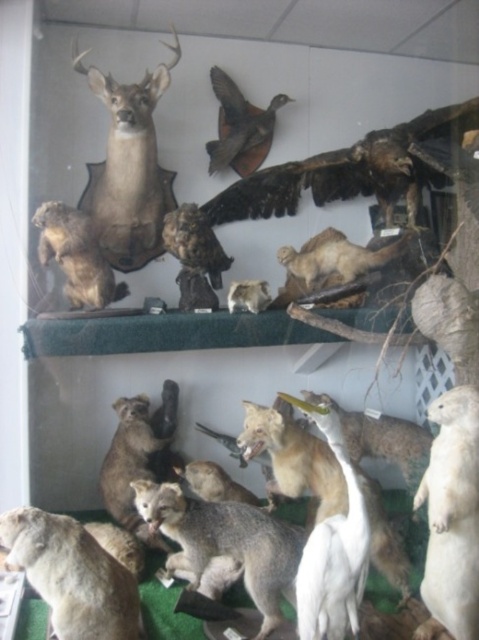
You are a museum visitor standing in front of the display. You notice the matte brown deer at upper left and the brown matte bird at upper center. Which object is located higher up on the shelves?

The brown matte bird at upper center is located higher up because the matte brown deer at upper left is positioned under it.

Looking at this image, you are a museum visitor standing in front of the display. You see the fuzzy brown fox at lower left and the brown fur owl at upper left. Which animal is located to the right of the other?

The fuzzy brown fox at lower left is positioned to the right of the brown fur owl at upper left.

You are a museum guide explaining the layout of the exhibit. Where is the matte brown deer at upper left located in terms of coordinates?

The matte brown deer at upper left is located at coordinates point (128, 168).